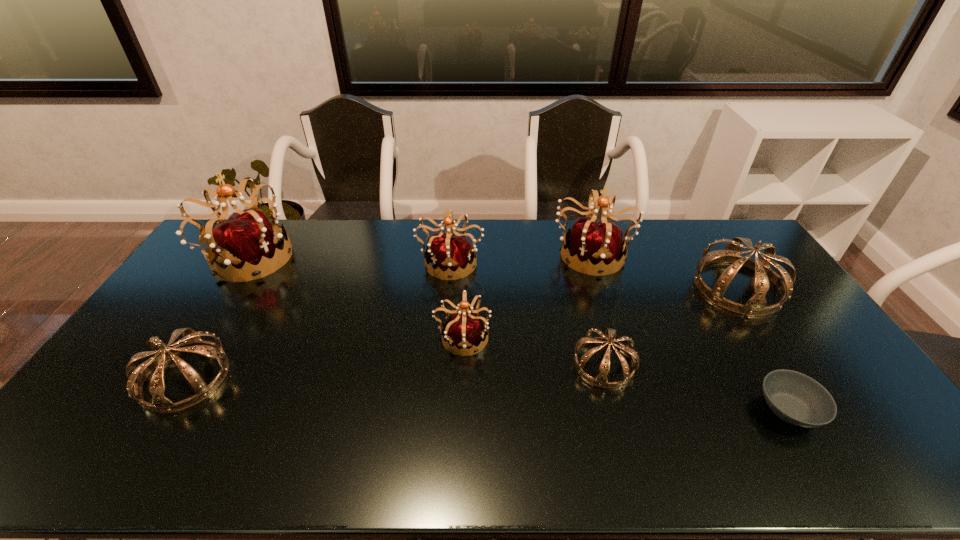
I want to click on vacant space that satisfies the following two spatial constraints: 1. on the front-facing side of the soup bowl; 2. on the left side of the nearest red tiara, so click(460, 409).

Identify the location of free space in the image that satisfies the following two spatial constraints: 1. on the front-facing side of the gray soup bowl; 2. on the right side of the smallest red tiara. Image resolution: width=960 pixels, height=540 pixels. (460, 409).

I want to click on vacant region that satisfies the following two spatial constraints: 1. on the back side of the second shortest object; 2. on the left side of the rightmost brown tiara, so click(x=584, y=287).

Locate an element on the screen. The width and height of the screenshot is (960, 540). free location that satisfies the following two spatial constraints: 1. on the front-facing side of the nearest red tiara; 2. on the left side of the gray soup bowl is located at coordinates (460, 409).

The image size is (960, 540). I want to click on vacant point that satisfies the following two spatial constraints: 1. on the front-facing side of the shortest object; 2. on the right side of the second tallest object, so click(639, 409).

Identify the location of free space that satisfies the following two spatial constraints: 1. on the front-facing side of the tallest object; 2. on the back side of the shortest tiara. The width and height of the screenshot is (960, 540). (180, 364).